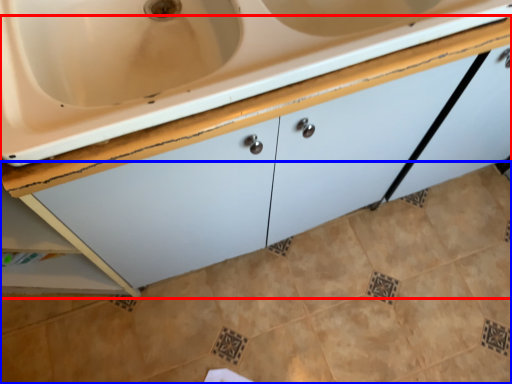
Question: Which of the following is the closest to the observer, cabinetry (highlighted by a red box) or ceramic tile (highlighted by a blue box)?

Choices:
 (A) cabinetry
 (B) ceramic tile

Answer: (A)